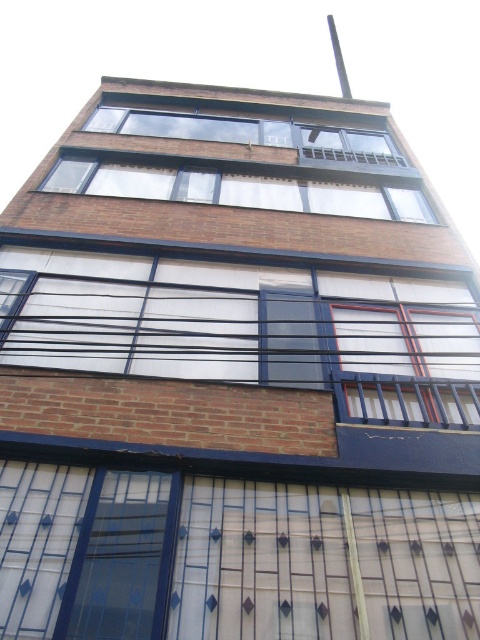
You are standing in front of a modern red brick building. You notice two windows, the white matte window at center and the clear glass window at upper center. Which window is located higher up on the building?

The clear glass window at upper center is higher up on the building since the white matte window at center is positioned under it.

You are an architect evaluating the building facade. You need to install a new security camera that requires a mounting point on a window that is larger in size. Which window should you choose between the white matte window at center and the clear glass windows at upper center?

The white matte window at center has a larger size compared to the clear glass windows at upper center, so you should choose the white matte window at center for installing the security camera.

Based on the photo, you are standing in front of the multi story building. You notice two points marked on the building facade. The first point is located at coordinate point (x=324, y=381) and the second at point (x=160, y=131). From your perspective, which point is closer to you?

Point (x=324, y=381) is in front of point (x=160, y=131), so the first point is closer to you.